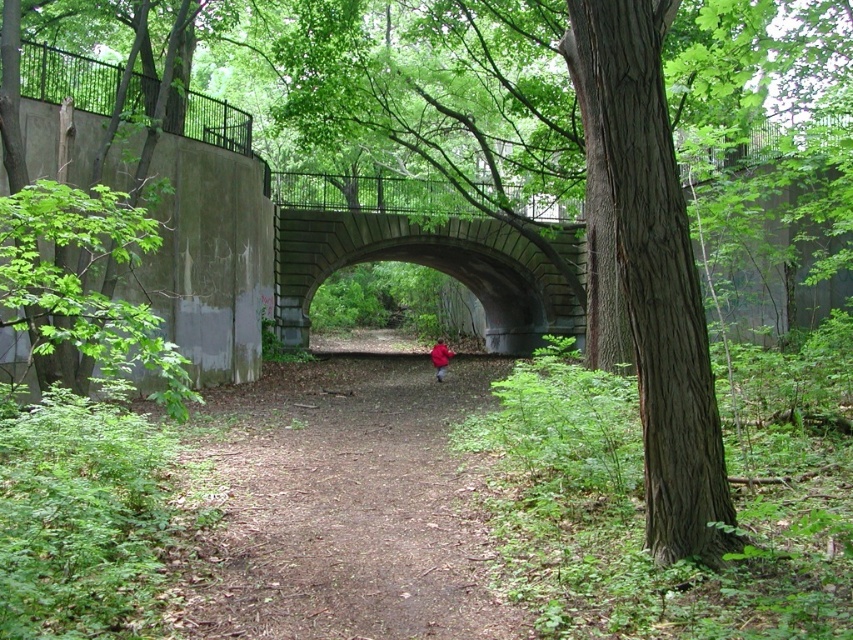
Is brown dirt path at center smaller than red matte jacket at center?

No, brown dirt path at center is not smaller than red matte jacket at center.

Which is in front, point (450, 428) or point (436, 380)?

Positioned in front is point (450, 428).

At what (x,y) coordinates should I click in order to perform the action: click on brown dirt path at center. Please return your answer as a coordinate pair (x, y). Looking at the image, I should click on (347, 500).

The image size is (853, 640). Describe the element at coordinates (654, 276) in the screenshot. I see `green textured bark tree at right` at that location.

Does point (590, 90) lie behind point (439, 337)?

No, it is not.

The image size is (853, 640). I want to click on green textured bark tree at right, so click(x=654, y=276).

Who is more forward, [567,333] or [436,378]?

Point [436,378] is more forward.

Is stone arch bridge at center above red matte jacket at center?

Correct, stone arch bridge at center is located above red matte jacket at center.

Does point (445, 228) come in front of point (440, 362)?

No, it is not.

I want to click on stone arch bridge at center, so click(428, 266).